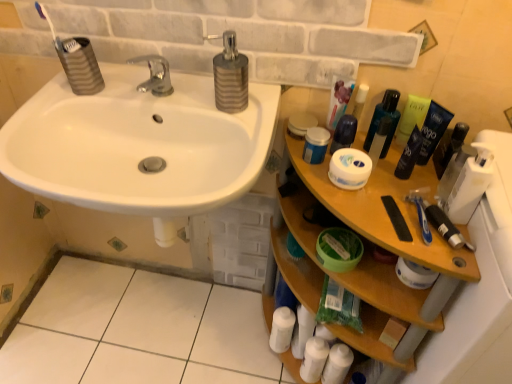
This screenshot has height=384, width=512. In order to click on free location to the left of silver metallic faucet at center in this screenshot , I will do `click(95, 95)`.